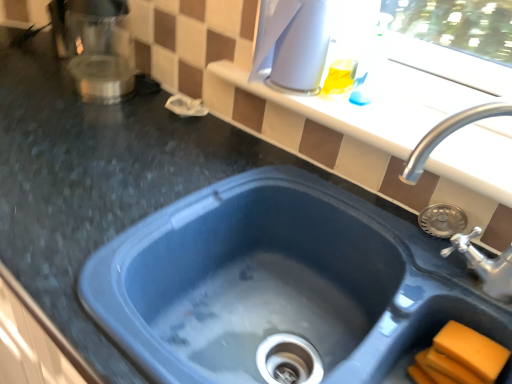
You are a GUI agent. You are given a task and a screenshot of the screen. Output one action in this format:
    pyautogui.click(x=<x>, y=<y>)
    Task: Click on the vacant space in front of satin silver coffee maker at upper left, which is the second appliance in right-to-left order
    The height and width of the screenshot is (384, 512).
    Given the screenshot: What is the action you would take?
    pyautogui.click(x=70, y=127)